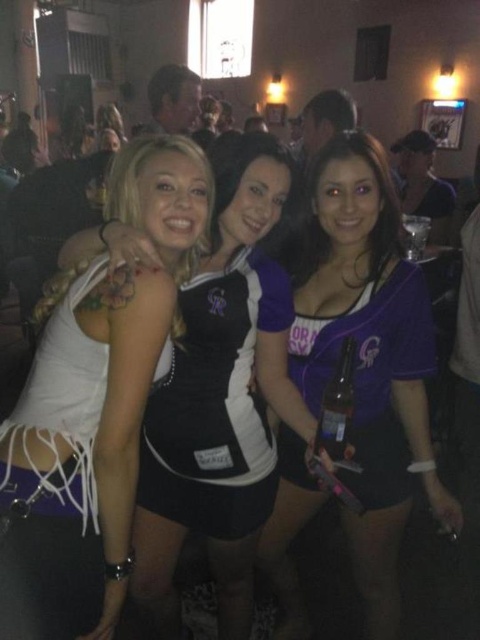
Question: Is purple matte shirt at center thinner than white matte dress at center?

Choices:
 (A) yes
 (B) no

Answer: (B)

Question: Observing the image, what is the correct spatial positioning of purple matte shirt at center in reference to clear glass bottle at center?

Choices:
 (A) left
 (B) right

Answer: (B)

Question: Among these points, which one is nearest to the camera?

Choices:
 (A) (52, 316)
 (B) (355, 394)
 (C) (343, 404)

Answer: (A)

Question: Does white matte dress at center appear on the right side of clear glass bottle at center?

Choices:
 (A) yes
 (B) no

Answer: (B)

Question: Which point is farther from the camera taking this photo?

Choices:
 (A) (400, 477)
 (B) (176, 452)

Answer: (A)

Question: Which object is the closest to the clear glass bottle at center?

Choices:
 (A) white lace skirt at left
 (B) white matte dress at center
 (C) purple matte shirt at center

Answer: (C)